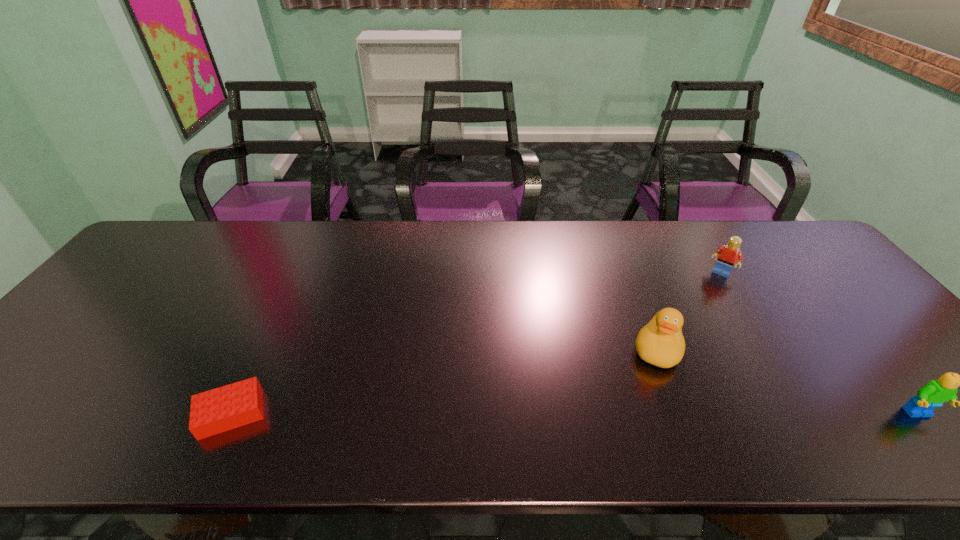
Where is `vacant space on the desktop that is between the shortest object and the rightmost object and is positioned on the face of the third object from right to left`? vacant space on the desktop that is between the shortest object and the rightmost object and is positioned on the face of the third object from right to left is located at coordinates (637, 414).

Identify the location of free spot on the desktop that is between the leftmost object and the rightmost object and is positioned on the front-facing side of the second Lego from right to left. (636, 414).